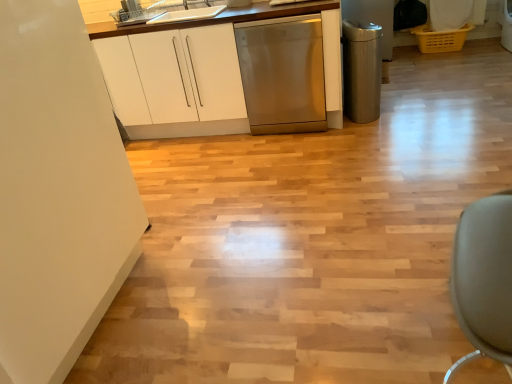
Question: Is point (132, 21) positioned closer to the camera than point (374, 104)?

Choices:
 (A) closer
 (B) farther

Answer: (A)

Question: From the image's perspective, is metallic dishwasher at upper center, the 2th appliance positioned from the bottom, above or below polished stainless steel trash can at right, the first appliance ordered from the bottom?

Choices:
 (A) above
 (B) below

Answer: (A)

Question: Which object is the farthest from the matte gray swivel chair at lower right?

Choices:
 (A) metallic dishwasher at upper center, arranged as the first appliance when viewed from the left
 (B) white glossy sink at upper center
 (C) stainless steel dishwasher at center
 (D) polished stainless steel trash can at right, which appears as the 2th appliance when viewed from the top
 (E) white glossy cabinet at upper left

Answer: (A)

Question: Which object is positioned closest to the white glossy sink at upper center?

Choices:
 (A) metallic dishwasher at upper center, the 2th appliance positioned from the bottom
 (B) polished stainless steel trash can at right, the first appliance ordered from the bottom
 (C) stainless steel dishwasher at center
 (D) white glossy cabinet at upper left
 (E) matte gray swivel chair at lower right

Answer: (A)